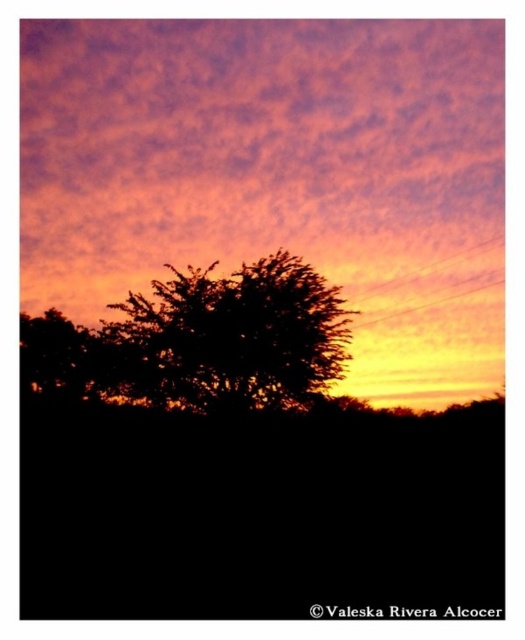
Is purple cloud at upper center shorter than silhouette tree at center?

Incorrect, purple cloud at upper center's height does not fall short of silhouette tree at center's.

Between purple cloud at upper center and silhouette tree at center, which one is positioned lower?

silhouette tree at center

Does point (462, 58) come closer to viewer compared to point (266, 349)?

No, it is not.

Where is `purple cloud at upper center`? purple cloud at upper center is located at coordinates (267, 157).